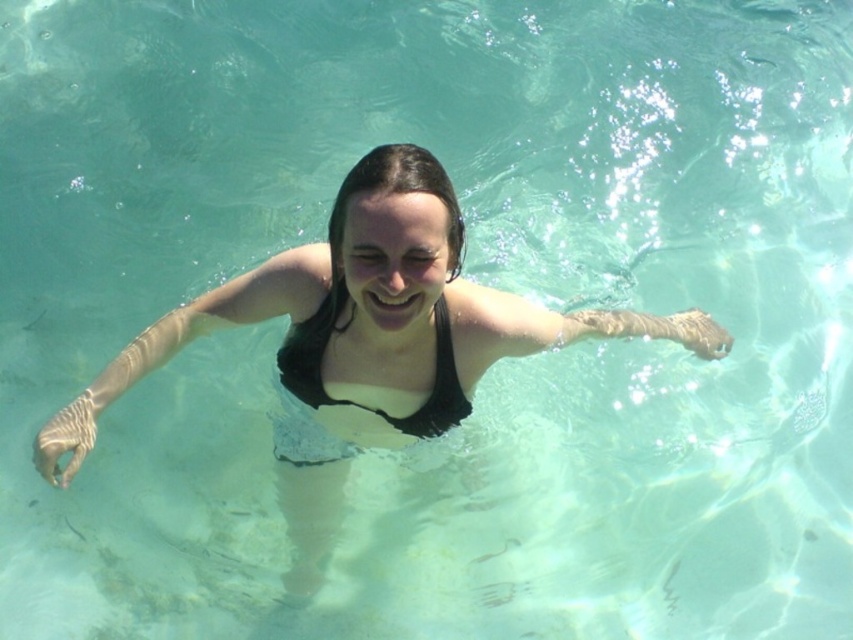
Who is more distant from viewer, [413,172] or [320,378]?

Point [320,378]

This screenshot has height=640, width=853. What are the coordinates of `black matte swimsuit at center` in the screenshot? It's located at (368, 323).

Does point (439, 188) lie in front of point (405, 433)?

Yes, point (439, 188) is closer to viewer.

At what (x,y) coordinates should I click in order to perform the action: click on black matte swimsuit at center. Please return your answer as a coordinate pair (x, y). The width and height of the screenshot is (853, 640). Looking at the image, I should click on (368, 323).